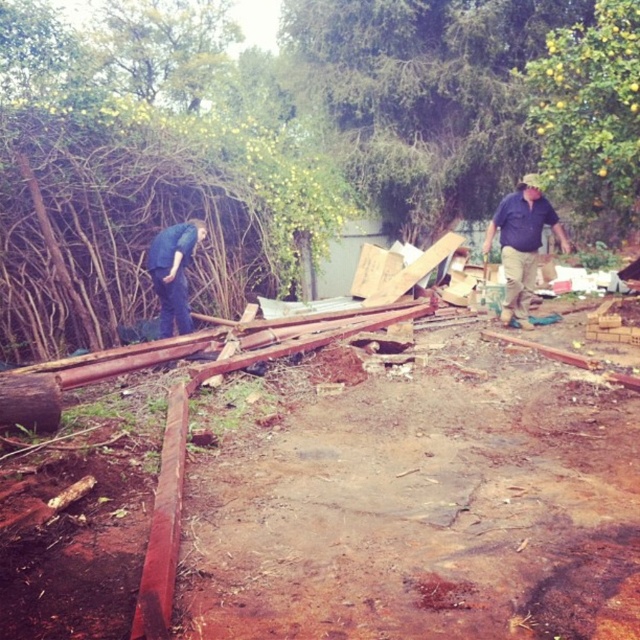
Question: Does matte blue shirt at right have a greater width compared to blue jeans at left?

Choices:
 (A) yes
 (B) no

Answer: (A)

Question: Can you confirm if matte blue shirt at right is positioned below blue jeans at left?

Choices:
 (A) yes
 (B) no

Answer: (B)

Question: Does matte blue shirt at right come in front of blue jeans at left?

Choices:
 (A) yes
 (B) no

Answer: (B)

Question: Among these points, which one is farthest from the camera?

Choices:
 (A) (182, 328)
 (B) (518, 300)

Answer: (B)